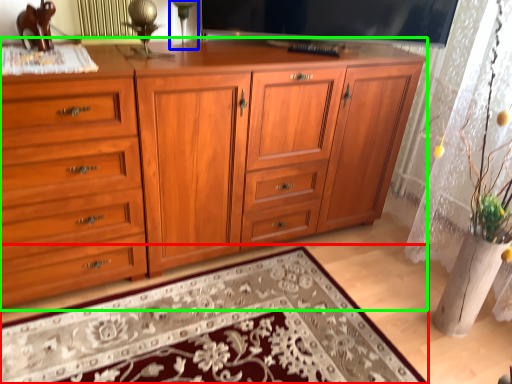
Question: Estimate the real-world distances between objects in this image. Which object is closer to mat (highlighted by a red box), table lamp (highlighted by a blue box) or chest of drawers (highlighted by a green box)?

Choices:
 (A) table lamp
 (B) chest of drawers

Answer: (B)